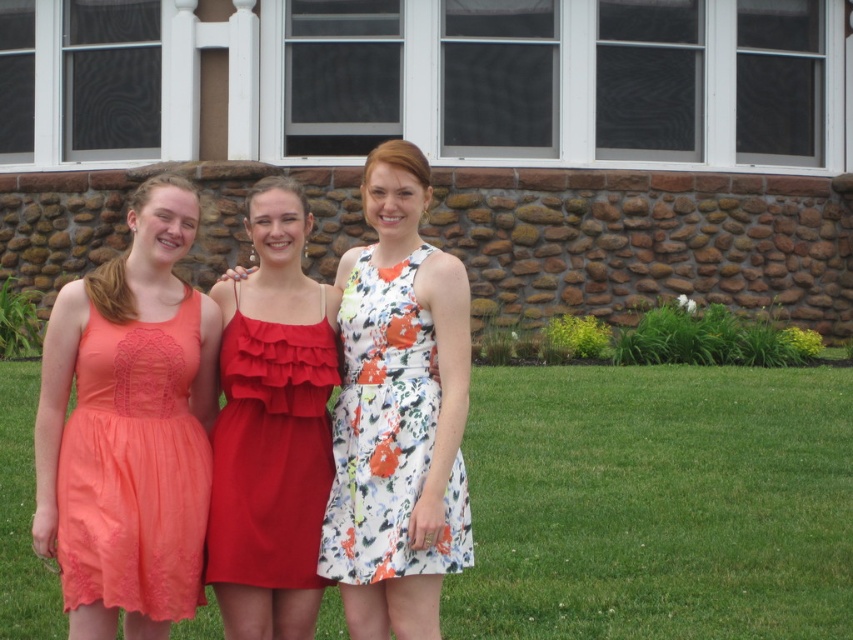
You are a photographer setting up for a group photo. You have two dresses in your viewfinder, the floral fabric dress at center and the coral lace dress at left. Which dress has a narrower silhouette?

The floral fabric dress at center is thinner than the coral lace dress at left, so it has a narrower silhouette.